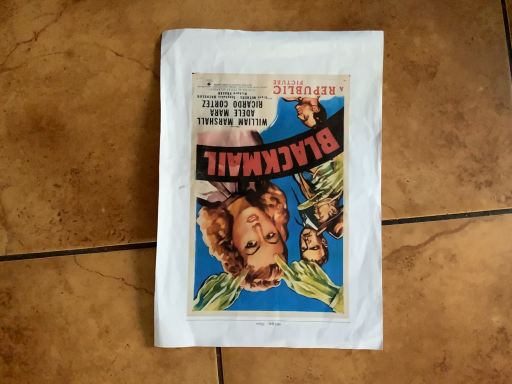
What do you see at coordinates (270, 190) in the screenshot? I see `vibrant paper poster at center` at bounding box center [270, 190].

You are a GUI agent. You are given a task and a screenshot of the screen. Output one action in this format:
    pyautogui.click(x=<x>, y=<y>)
    Task: Click on the vibrant paper poster at center
    The height and width of the screenshot is (384, 512).
    Given the screenshot: What is the action you would take?
    pyautogui.click(x=270, y=190)

Where is `vibrant paper poster at center`? Image resolution: width=512 pixels, height=384 pixels. vibrant paper poster at center is located at coordinates 270,190.